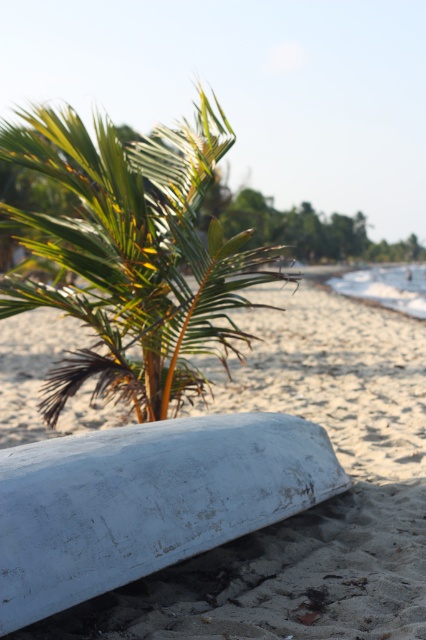
Question: In this image, where is white sandy beach at lower center located relative to green leafy palm tree at center?

Choices:
 (A) above
 (B) below

Answer: (B)

Question: Does white sandy beach at lower center have a greater width compared to green leafy palm tree at center?

Choices:
 (A) yes
 (B) no

Answer: (B)

Question: Does white sandy beach at lower center appear over green leafy palm tree at center?

Choices:
 (A) yes
 (B) no

Answer: (B)

Question: Which point is farther to the camera?

Choices:
 (A) (66, 253)
 (B) (402, 499)

Answer: (B)